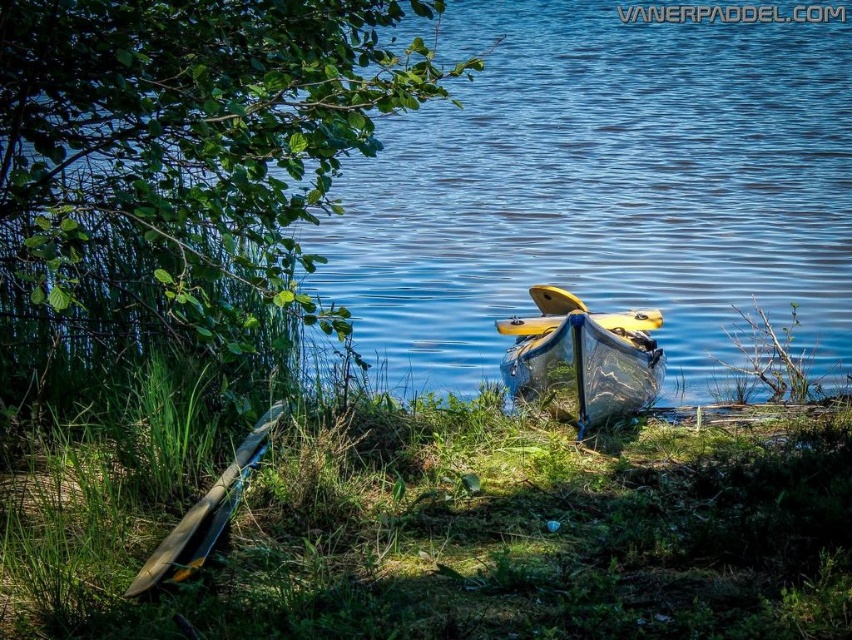
Question: Can you confirm if green grass at lower left is smaller than yellow glossy kayak at center?

Choices:
 (A) yes
 (B) no

Answer: (B)

Question: Is green leafy tree at upper left to the left of matte yellow canoe at lower left from the viewer's perspective?

Choices:
 (A) yes
 (B) no

Answer: (A)

Question: Which point is closer to the camera taking this photo?

Choices:
 (A) (158, 556)
 (B) (648, 312)
 (C) (361, 420)

Answer: (A)

Question: Considering the real-world distances, which object is farthest from the yellow glossy kayak at center?

Choices:
 (A) green leafy tree at upper left
 (B) green grass at lower left

Answer: (A)

Question: Among these points, which one is nearest to the camera?

Choices:
 (A) (335, 595)
 (B) (210, 538)
 (C) (173, 35)
 (D) (590, 340)

Answer: (A)

Question: Can you confirm if green leafy tree at upper left is positioned to the left of matte yellow canoe at lower left?

Choices:
 (A) no
 (B) yes

Answer: (B)